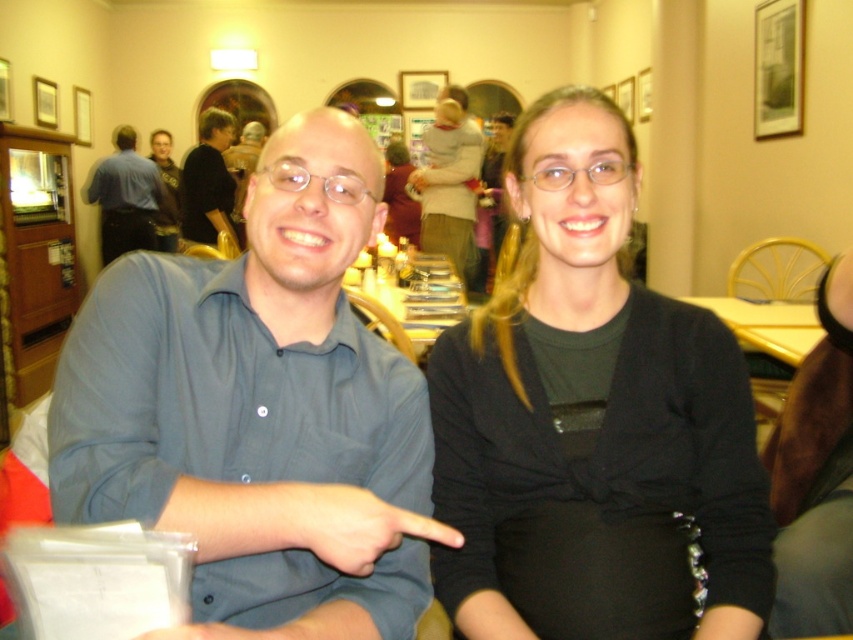
Is black matte shirt at center closer to camera compared to matte black shirt at upper left?

Yes, it is in front of matte black shirt at upper left.

Is black matte shirt at center below matte black shirt at upper left?

Yes, black matte shirt at center is below matte black shirt at upper left.

Where is `black matte shirt at center`? This screenshot has width=853, height=640. black matte shirt at center is located at coordinates (592, 422).

Which is behind, point (177, 490) or point (129, 168)?

The point (129, 168) is behind.

Is blue button-down shirt at center below blue shirt at center?

Correct, blue button-down shirt at center is located below blue shirt at center.

Identify the location of blue button-down shirt at center. (260, 410).

Does point (341, 116) come behind point (190, 164)?

No, it is not.

Who is more forward, (65, 486) or (190, 202)?

Point (65, 486)

Where is `blue button-down shirt at center`? This screenshot has width=853, height=640. blue button-down shirt at center is located at coordinates (260, 410).